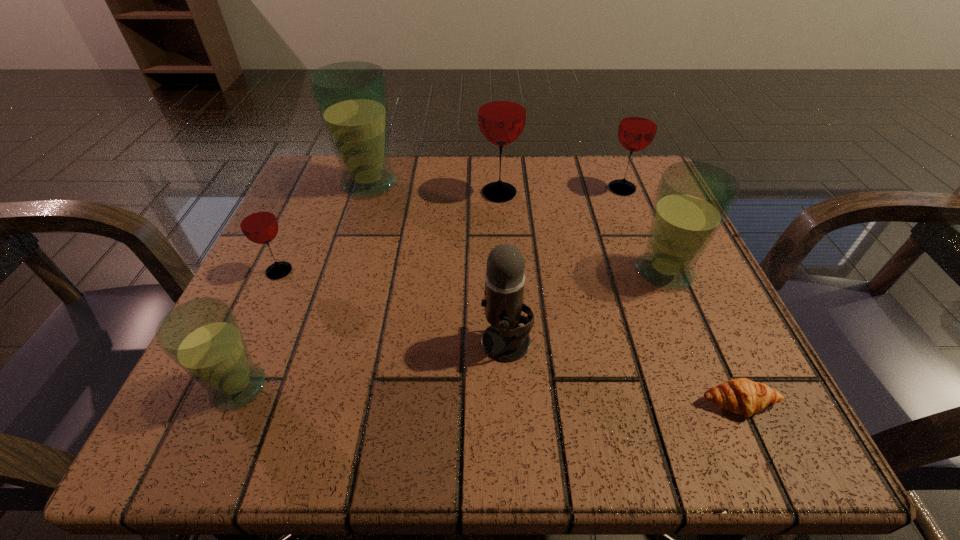
At what (x,y) coordinates should I click in order to perform the action: click on empty space between the second nearest blue glass and the biggest red glass. Please return your answer as a coordinate pair (x, y). Looking at the image, I should click on point(582,233).

The height and width of the screenshot is (540, 960). What are the coordinates of `vacant space that is in between the second biggest red glass and the rightmost blue glass` in the screenshot? It's located at (643, 231).

Locate which object is the third closest to the rightmost blue glass. Please provide its 2D coordinates. Your answer should be formatted as a tuple, i.e. [(x, y)], where the tuple contains the x and y coordinates of a point satisfying the conditions above.

[(504, 340)]

Point out which object is positioned as the second nearest to the second biggest blue glass. Please provide its 2D coordinates. Your answer should be formatted as a tuple, i.e. [(x, y)], where the tuple contains the x and y coordinates of a point satisfying the conditions above.

[(742, 396)]

Identify which glass is the closest to the smallest blue glass. Please provide its 2D coordinates. Your answer should be formatted as a tuple, i.e. [(x, y)], where the tuple contains the x and y coordinates of a point satisfying the conditions above.

[(258, 223)]

Identify the location of glass identified as the fourth closest to the second farthest blue glass. (202, 336).

You are a GUI agent. You are given a task and a screenshot of the screen. Output one action in this format:
    pyautogui.click(x=<x>, y=<y>)
    Task: Click on the red glass that is the third closest one to the biggest blue glass
    This screenshot has height=540, width=960.
    Given the screenshot: What is the action you would take?
    pyautogui.click(x=638, y=125)

Identify which red glass is the nearest to the leftmost red glass. Please provide its 2D coordinates. Your answer should be formatted as a tuple, i.e. [(x, y)], where the tuple contains the x and y coordinates of a point satisfying the conditions above.

[(502, 108)]

Select which blue glass appears as the closest to the farthest blue glass. Please provide its 2D coordinates. Your answer should be formatted as a tuple, i.e. [(x, y)], where the tuple contains the x and y coordinates of a point satisfying the conditions above.

[(202, 336)]

At what (x,y) coordinates should I click in order to perform the action: click on blue glass that can be found as the third closest to the leftmost red glass. Please return your answer as a coordinate pair (x, y). This screenshot has width=960, height=540. Looking at the image, I should click on (693, 199).